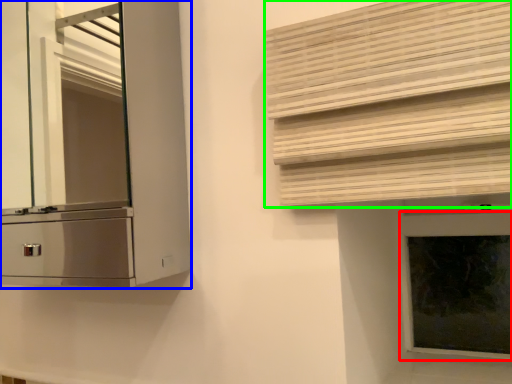
Question: Which object is the farthest from window frame (highlighted by a red box)? Choose among these: cabinetry (highlighted by a blue box) or shutter (highlighted by a green box).

Choices:
 (A) cabinetry
 (B) shutter

Answer: (A)